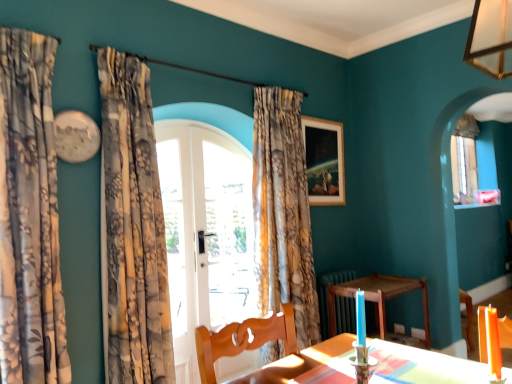
Question: Is orange wax candle at lower right wider or thinner than wooden table at lower center?

Choices:
 (A) thin
 (B) wide

Answer: (A)

Question: Does point (486, 359) appear closer or farther from the camera than point (349, 296)?

Choices:
 (A) farther
 (B) closer

Answer: (B)

Question: Estimate the real-world distances between objects in this image. Which object is closer to the floral fabric curtain at left, which is counted as the 2th curtain, starting from the back?

Choices:
 (A) floral fabric curtain at center, the 1th curtain in the back-to-front sequence
 (B) wooden table at lower center
 (C) floral fabric curtain at left, the third curtain positioned from the back
 (D) orange wax candle at lower right
 (E) wooden picture frame at upper center

Answer: (C)

Question: Estimate the real-world distances between objects in this image. Which object is closer to the wooden picture frame at upper center?

Choices:
 (A) clear glass door at center
 (B) floral fabric curtain at center, positioned as the third curtain in left-to-right order
 (C) orange wax candle at lower right
 (D) floral fabric curtain at left, the third curtain positioned from the back
 (E) floral fabric curtain at left, the 2th curtain from the left

Answer: (B)